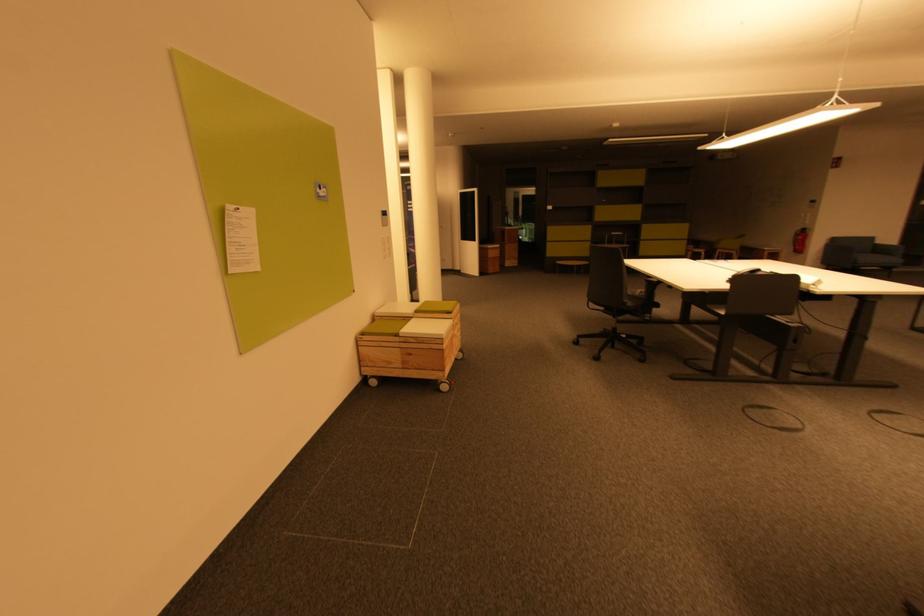
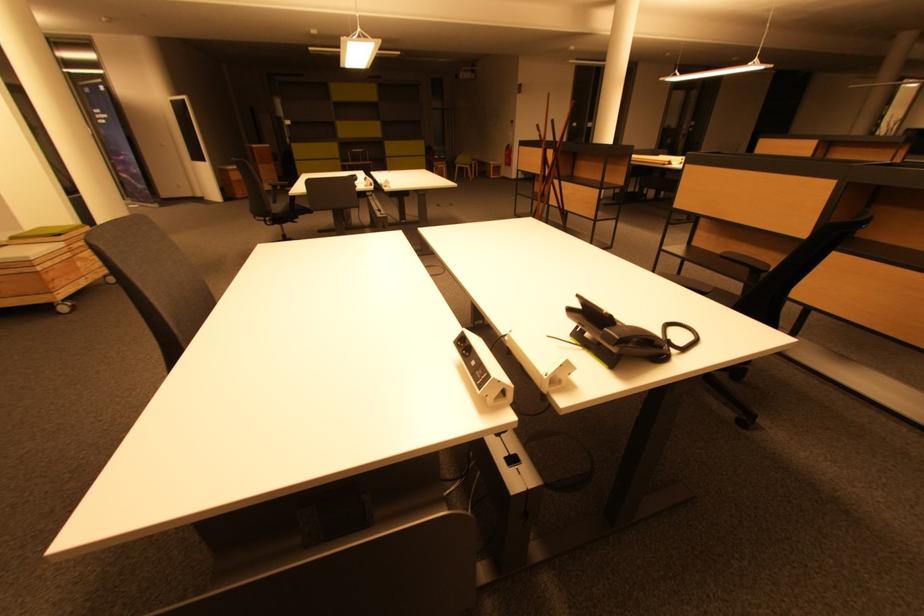
Where in the second image is the point corresponding to [805,240] from the first image?

(512, 155)